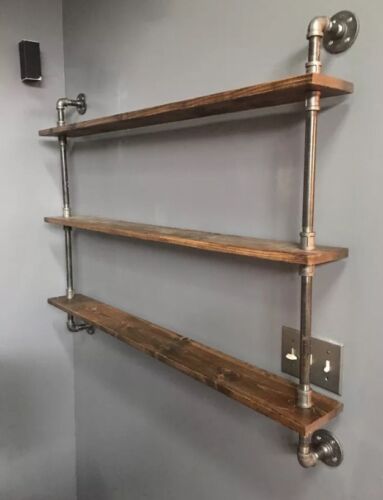
The width and height of the screenshot is (383, 500). I want to click on wall, so click(x=200, y=312), click(x=34, y=340).